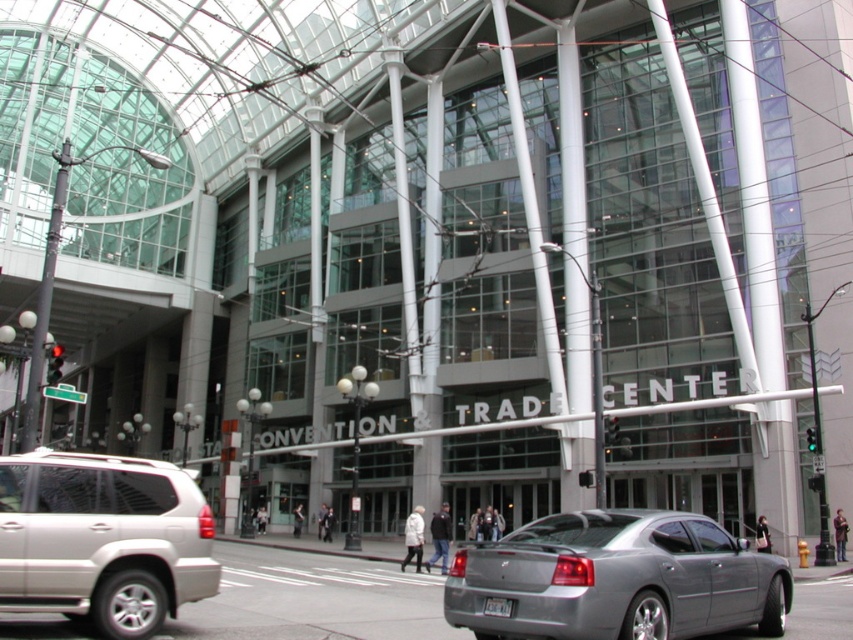
Does silver metallic sedan at center have a smaller size compared to satin silver suv at lower left?

Correct, silver metallic sedan at center occupies less space than satin silver suv at lower left.

Does silver metallic sedan at center have a lesser width compared to satin silver suv at lower left?

Indeed, silver metallic sedan at center has a lesser width compared to satin silver suv at lower left.

Is point (608, 604) less distant than point (149, 576)?

Yes, point (608, 604) is closer to viewer.

Locate an element on the screen. silver metallic sedan at center is located at coordinates (x=614, y=579).